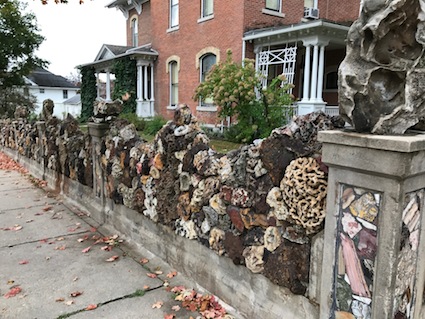
The image size is (425, 319). I want to click on air conditioner, so (313, 11).